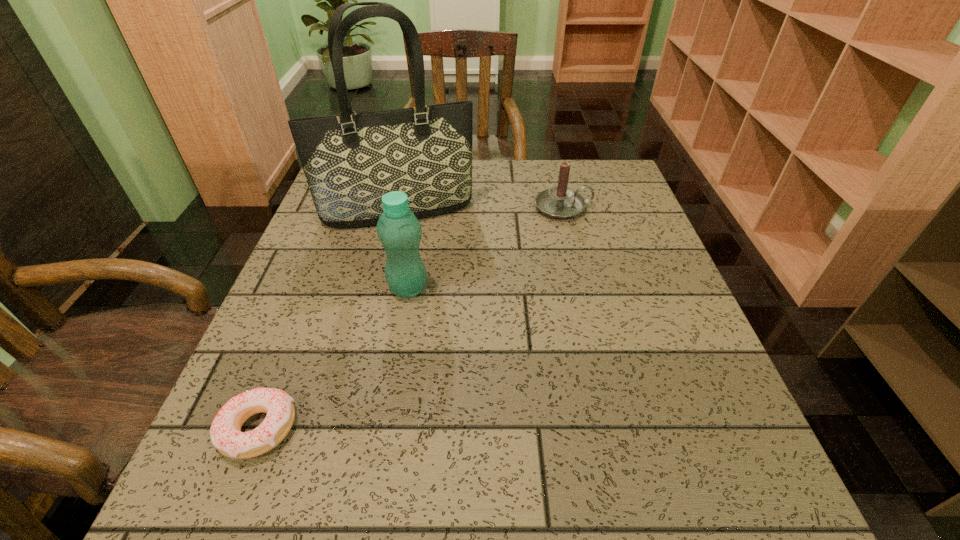
Locate an element on the screen. free space located 0.320m on the back of the shortest object is located at coordinates (321, 270).

I want to click on tote bag situated at the far edge, so click(350, 161).

This screenshot has width=960, height=540. In order to click on candle positioned at the far edge in this screenshot , I will do `click(561, 202)`.

Where is `object situated at the near edge`? object situated at the near edge is located at coordinates (225, 431).

At what (x,y) coordinates should I click in order to perform the action: click on tote bag present at the left edge. Please return your answer as a coordinate pair (x, y). This screenshot has height=540, width=960. Looking at the image, I should click on (350, 161).

The image size is (960, 540). In order to click on doughnut situated at the left edge in this screenshot , I will do `click(225, 431)`.

Image resolution: width=960 pixels, height=540 pixels. I want to click on object that is positioned at the right edge, so click(x=561, y=202).

Locate an element on the screen. object that is positioned at the far left corner is located at coordinates (350, 161).

Find the location of a particular element. This screenshot has height=540, width=960. object present at the near left corner is located at coordinates (225, 431).

At what (x,y) coordinates should I click in order to perform the action: click on object located in the far right corner section of the desktop. Please return your answer as a coordinate pair (x, y). Image resolution: width=960 pixels, height=540 pixels. Looking at the image, I should click on (561, 202).